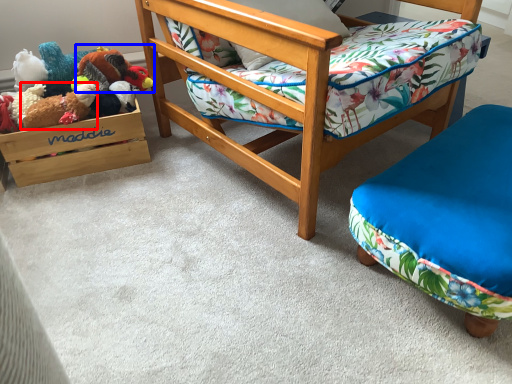
Question: Which object is closer to the camera taking this photo, toy (highlighted by a red box) or toy (highlighted by a blue box)?

Choices:
 (A) toy
 (B) toy

Answer: (A)